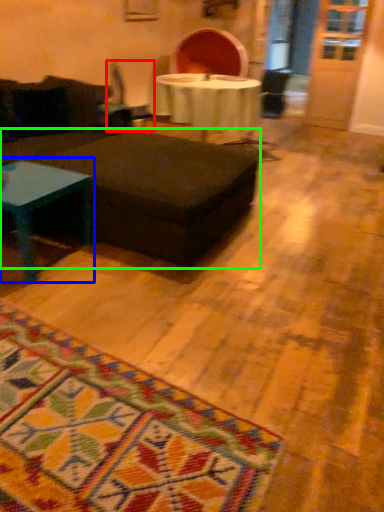
Question: Considering the real-world distances, which object is closest to swivel chair (highlighted by a red box)? coffee table (highlighted by a blue box) or table (highlighted by a green box).

Choices:
 (A) coffee table
 (B) table

Answer: (B)